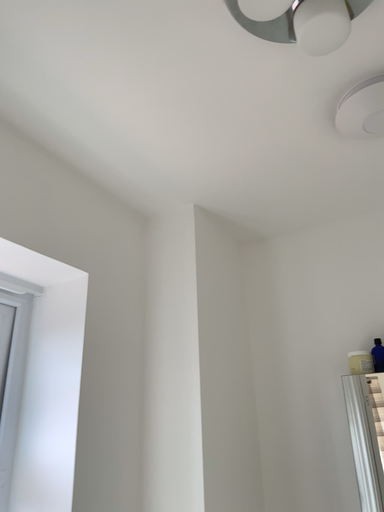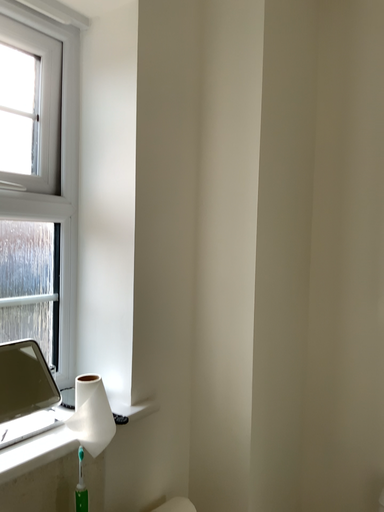
Question: Which way did the camera rotate in the video?

Choices:
 (A) rotated upward
 (B) rotated downward

Answer: (B)